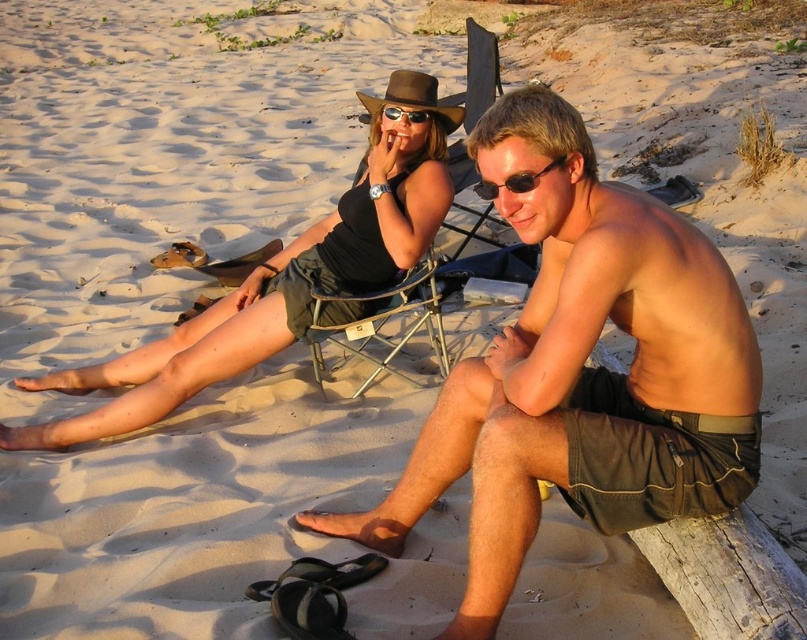
Looking at this image, you are a photographer trying to capture a closeup shot of the matte black tank top at upper center and the matte black sunglasses at center. Since you want to focus on both objects equally, which one should you zoom in more on to ensure they appear the same size in the photo?

The matte black tank top at upper center has a larger size compared to matte black sunglasses at center, so you should zoom in more on the matte black sunglasses at center to balance their sizes in the photo.

You are standing at the origin point of the coordinate system in the image. There is a metallic folding chair at center represented by point (x=477, y=74). What direction should you move in to reach the metallic folding chair at center?

The metallic folding chair at center is located at coordinates (x=477, y=74). Since you are at the origin, you should move towards the point (x=477, y=74), which is northeast direction from the origin.

You are a photographer trying to capture a candid shot of the two people on the beach. To avoid blocking the sunlight, you need to position yourself so that the metallic folding chair at center does not cast a shadow over the matte black sunglasses at center. Based on the scene description, where should you position yourself relative to the subjects?

The metallic folding chair at center is above the matte black sunglasses at center, so positioning yourself so the sun is behind you and facing towards the subjects will ensure the chair casts a shadow away from the sunglasses.